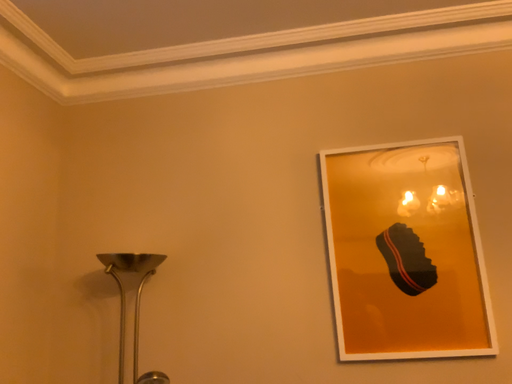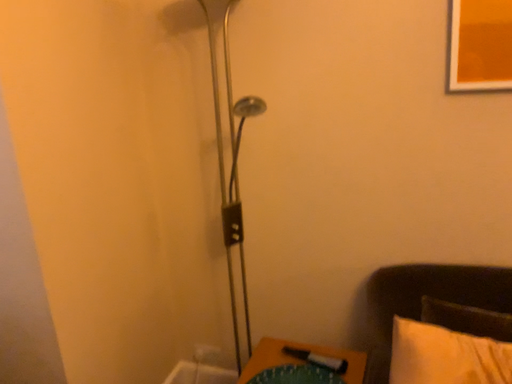
Question: How did the camera likely rotate when shooting the video?

Choices:
 (A) rotated upward
 (B) rotated downward

Answer: (B)